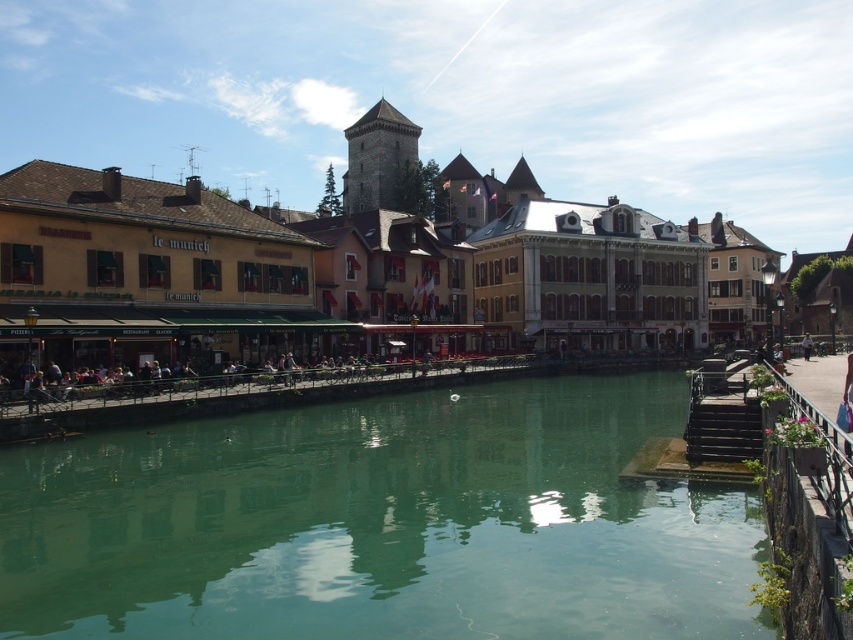
You are a tourist standing at the light brown leather jacket at center position, and you want to cross the river to the historic tower in the background. The bridge is closed for maintenance. Is the green reflective water at lower center far enough to swim across? Assume an average swimming speed of 2 meters per minute and you have 30 minutes before the tower closes. Please answer with yes or no and explain.

The distance between the green reflective water at lower center and the light brown leather jacket at center is 53.17 meters. Swimming at 2 meters per minute, you would need 26.58 minutes to cover the distance. Since you have 30 minutes before the tower closes, you can make it in time. Answer is yes.

You are standing at the riverside and want to visit the historic tower mentioned in the scene. If you walk straight ahead from your current position, will you reach the point marked at coordinates point (376,156) before reaching the historic tower?

The point marked at coordinates point (376,156) is 621.55 feet away from the viewer. Since the historic tower is part of the background in the scene, it is farther away than the point. Therefore, walking straight ahead would reach the point before the historic tower.

You are a tourist standing on the right bank of the river. You see the dark gray stone tower at center and the light brown leather jacket at center. Which object is located to the left of the other?

The dark gray stone tower at center is positioned on the left side of light brown leather jacket at center, so the dark gray stone tower at center is to the left of the light brown leather jacket at center.